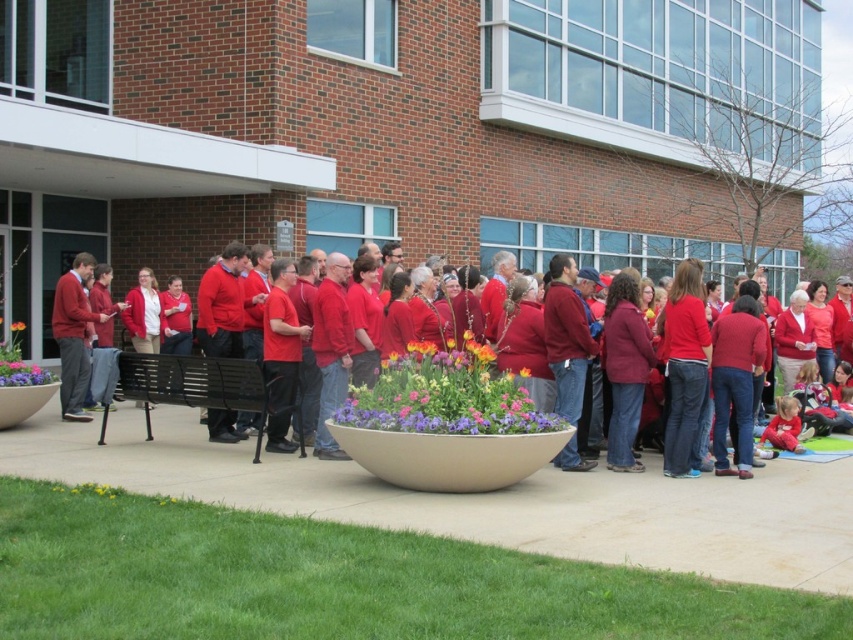
Consider the image. Does black metal bench at lower left appear on the right side of orange matte flower at center?

Correct, you'll find black metal bench at lower left to the right of orange matte flower at center.

Between point (190, 362) and point (13, 328), which one is positioned in front?

Positioned in front is point (190, 362).

Between point (209, 422) and point (24, 328), which one is positioned in front?

Point (209, 422) is more forward.

In order to click on black metal bench at lower left in this screenshot , I will do `click(195, 385)`.

Is black metal bench at lower left positioned at the back of matte red sweater at center?

Yes, black metal bench at lower left is further from the viewer.

Is the position of black metal bench at lower left less distant than that of matte red sweater at center?

No.

Measure the distance between point (229, 401) and camera.

Point (229, 401) is 30.82 feet from camera.

Find the location of a particular element. Image resolution: width=853 pixels, height=640 pixels. black metal bench at lower left is located at coordinates (195, 385).

Which is more to the right, matte red sweater at center or matte ceramic pot at lower left?

Positioned to the right is matte red sweater at center.

Looking at this image, between matte red sweater at center and matte ceramic pot at lower left, which one has less height?

With less height is matte ceramic pot at lower left.

Is point (624, 269) in front of point (3, 369)?

No, (624, 269) is further to viewer.

This screenshot has width=853, height=640. I want to click on matte red sweater at center, so click(x=265, y=260).